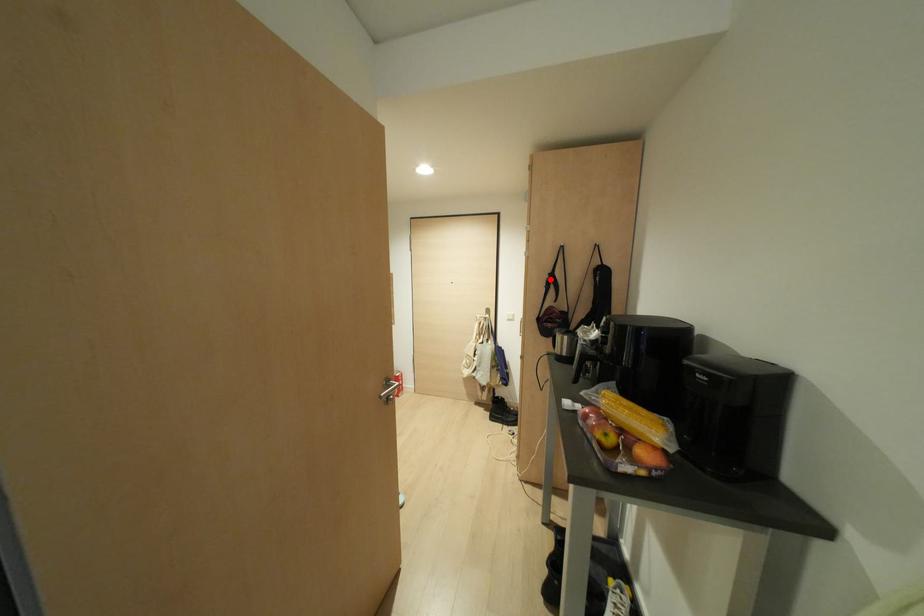
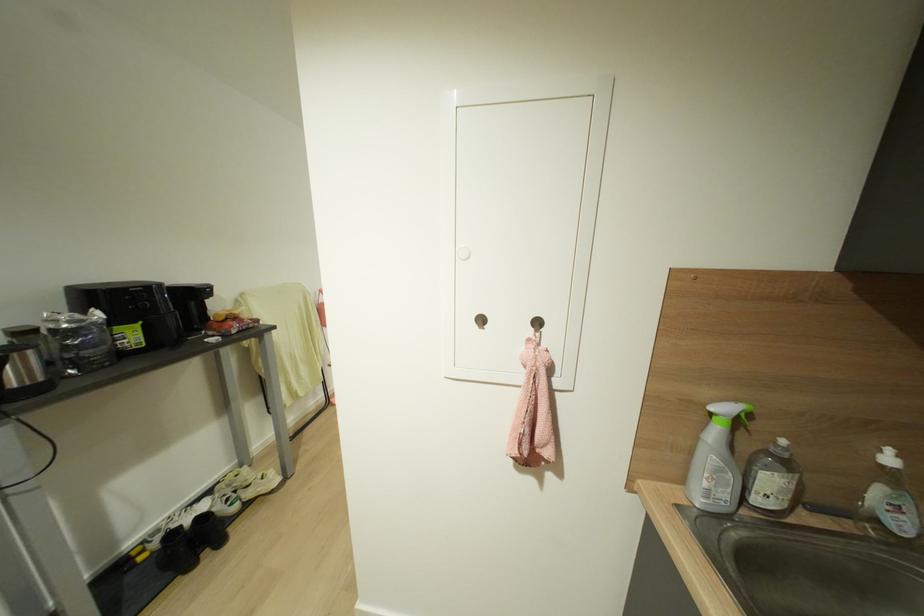
Question: I am providing you with two images of the same scene from different viewpoints. A red point is marked on the first image. Can you still see the location of the red point in image 2?

Choices:
 (A) Yes
 (B) No

Answer: (B)